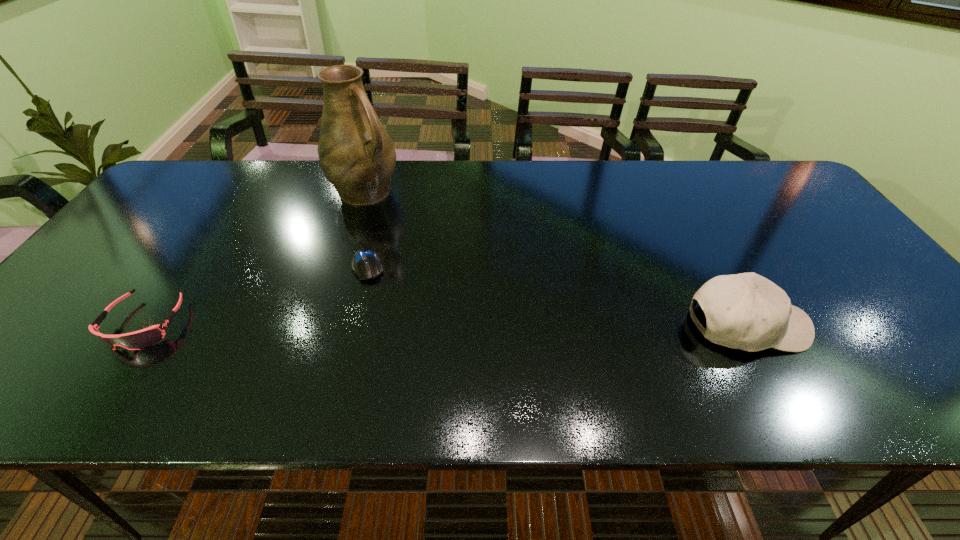
Identify the location of the second shortest object. This screenshot has height=540, width=960. (137, 340).

I want to click on goggles, so click(137, 340).

Identify the location of the third shortest object. (746, 311).

Where is `the rightmost object`? The height and width of the screenshot is (540, 960). the rightmost object is located at coordinates (746, 311).

Find the location of a particular element. The image size is (960, 540). pitcher is located at coordinates (357, 156).

The image size is (960, 540). In order to click on the farthest object in this screenshot , I will do `click(357, 156)`.

Find the location of a particular element. This screenshot has height=540, width=960. the second farthest object is located at coordinates tap(365, 264).

In order to click on the shortest object in this screenshot , I will do `click(365, 264)`.

This screenshot has height=540, width=960. I want to click on vacant point located on the front-facing side of the third shortest object, so 913,325.

The image size is (960, 540). Identify the location of vacant area located 0.070m on the handle side of the pitcher. (397, 217).